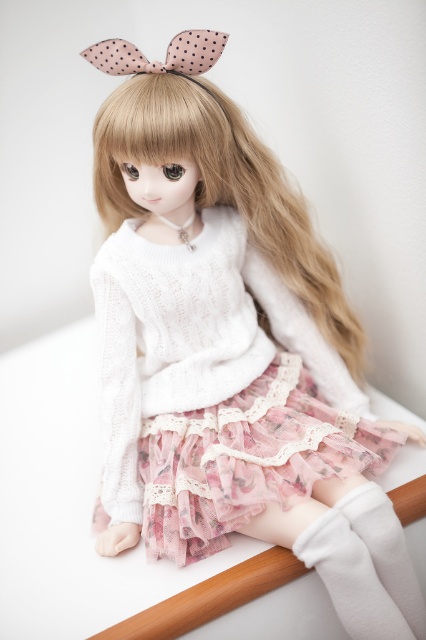
You are a fashion designer observing the doll. You need to determine which object has a greater width between the blondehair at center and the pink dotted fabric bow at upper center. Which one is wider?

The blondehair at center is wider than the pink dotted fabric bow at upper center according to the description.

You are a photographer trying to capture the perfect shot of the doll in the image. To ensure the blondehair at center is centered in your frame, where should you position your camera relative to the doll?

The blondehair at center is located at point coordinates of 0.292 on the x axis and 0.521 on the y axis. To center it, the camera should be positioned so that the frame aligns with these coordinates.